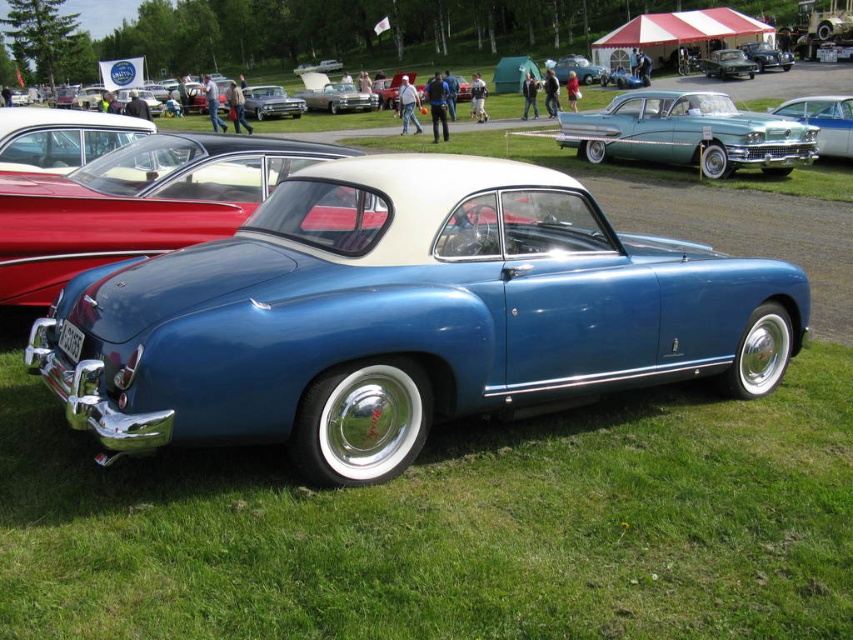
Who is higher up, blue metallic car at center or metallic blue car at center?

Positioned higher is metallic blue car at center.

Is point (635, 237) closer to viewer compared to point (558, 72)?

Yes.

I want to click on blue metallic car at center, so (x=402, y=316).

Is shiny chrome grille at center to the left of metallic blue car at center from the viewer's perspective?

Yes, shiny chrome grille at center is to the left of metallic blue car at center.

Who is positioned more to the left, shiny chrome grille at center or metallic blue car at center?

shiny chrome grille at center

Does point (842, 150) come farther from viewer compared to point (582, 72)?

That is False.

This screenshot has width=853, height=640. Identify the location of shiny chrome grille at center. (822, 122).

Which of these two, shiny chrome car at center or metallic blue car at center, stands shorter?

With less height is metallic blue car at center.

Does shiny chrome car at center appear on the right side of metallic blue car at center?

No, shiny chrome car at center is not to the right of metallic blue car at center.

Who is more forward, (316, 109) or (579, 61)?

Point (316, 109)

This screenshot has height=640, width=853. In order to click on shiny chrome car at center in this screenshot , I will do `click(334, 93)`.